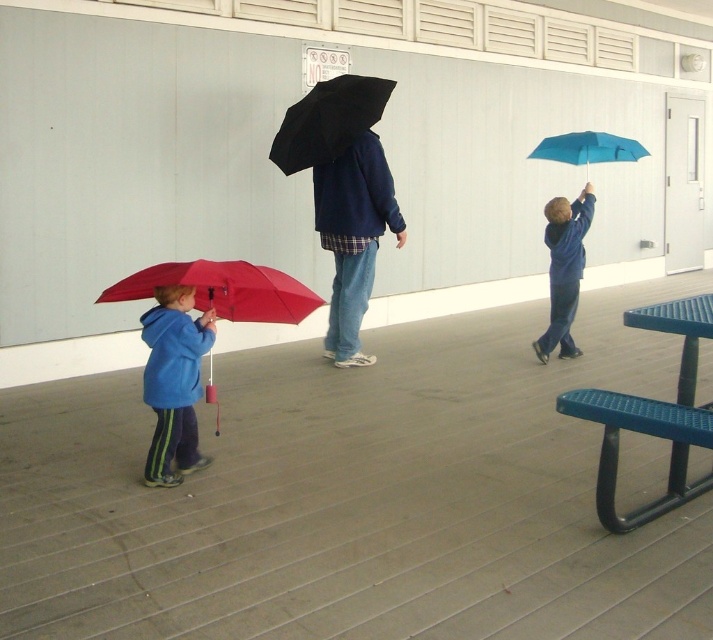
You are a fashion designer observing the scene and need to create a size chart for the clothing items. Which clothing item, the matte blue hoodie at center or the blue matte jacket at upper right, requires more fabric to produce?

The matte blue hoodie at center requires more fabric to produce because it is bigger than the blue matte jacket at upper right.

You are a photographer trying to capture both the matte blue hoodie at center and the blue matte jacket at upper right in a single frame. Since you can only focus on one subject at a time, which one should you choose to ensure the other remains in the background?

You should focus on the matte blue hoodie at center because it is closer to the viewer than the blue matte jacket at upper right, so if you focus on the closer one, the farther one will naturally be in the background.

In the scene shown: You are standing at the center of the wooden deck and want to place a new bench exactly 0.5 meters to the right of the blue textured picnic table at lower right. What are the coordinates of the bench?

The coordinates of the bench would be approximately 0.648 plus 0.5 meters in the x direction, so the new coordinates are approximately (651, 639).